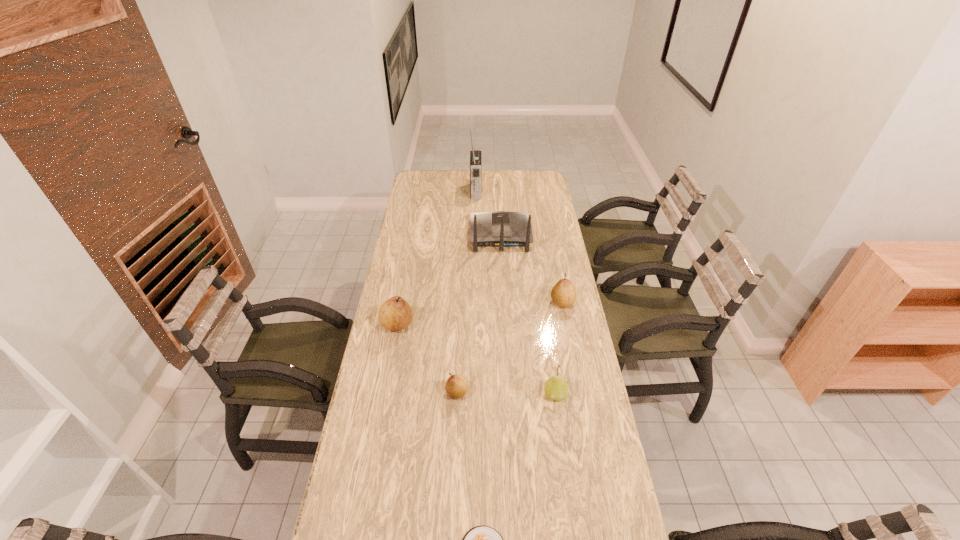
Locate an element on the screen. This screenshot has width=960, height=540. free space between the second brown pear from right to left and the second farthest pear is located at coordinates (427, 359).

Identify the location of object that stands as the third closest to the second farthest pear. click(556, 388).

In order to click on object identified as the second closest to the farthest object in this screenshot , I will do `click(563, 294)`.

Select which pear appears as the fourth closest to the shortest object. Please provide its 2D coordinates. Your answer should be formatted as a tuple, i.e. [(x, y)], where the tuple contains the x and y coordinates of a point satisfying the conditions above.

[(563, 294)]

Choose which pear is the third nearest neighbor to the router. Please provide its 2D coordinates. Your answer should be formatted as a tuple, i.e. [(x, y)], where the tuple contains the x and y coordinates of a point satisfying the conditions above.

[(456, 386)]

Find the location of `brown pear identified as the second closest to the nearest object`. brown pear identified as the second closest to the nearest object is located at coordinates (395, 314).

This screenshot has width=960, height=540. Identify the location of the closest brown pear relative to the rightmost brown pear. (456, 386).

Locate an element on the screen. The image size is (960, 540). free region that satisfies the following two spatial constraints: 1. on the display of the green pear; 2. on the right side of the tallest object is located at coordinates click(x=473, y=394).

Locate an element on the screen. free spot that satisfies the following two spatial constraints: 1. on the front-facing side of the second farthest object; 2. on the display of the tallest object is located at coordinates (498, 191).

Where is `free space that satisfies the following two spatial constraints: 1. on the display of the tallest object; 2. on the front-facing side of the router`? Image resolution: width=960 pixels, height=540 pixels. free space that satisfies the following two spatial constraints: 1. on the display of the tallest object; 2. on the front-facing side of the router is located at coordinates (475, 235).